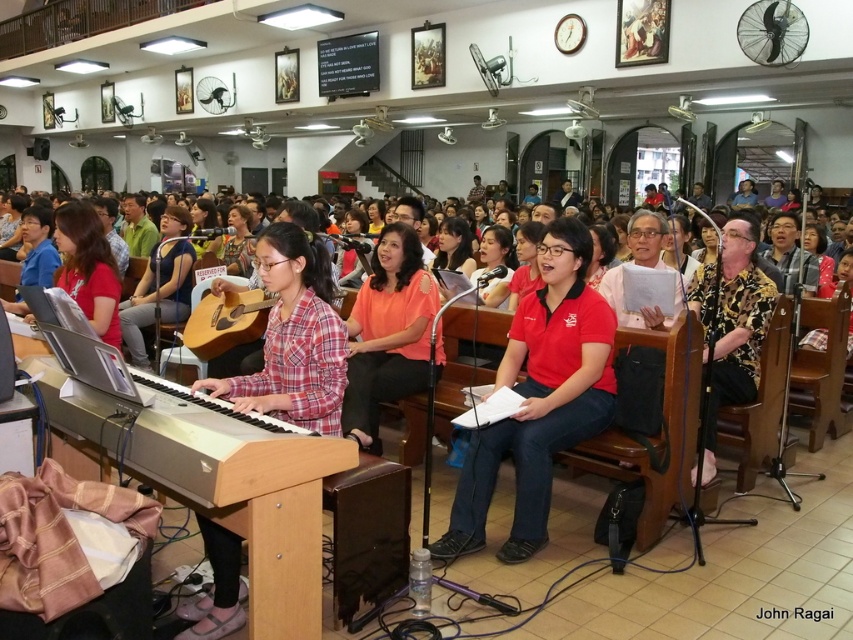
Question: Which point is farther to the camera?

Choices:
 (A) wooden piano at lower left
 (B) plaid fabric shirt at center
 (C) plaid fabric guitar at center
 (D) matte pink shirt at center

Answer: (C)

Question: Can you confirm if wooden piano at lower left is smaller than plaid fabric guitar at center?

Choices:
 (A) yes
 (B) no

Answer: (A)

Question: Is wooden piano at lower left behind orange matte shirt at center?

Choices:
 (A) no
 (B) yes

Answer: (A)

Question: Among these points, which one is farthest from the camera?

Choices:
 (A) (238, 592)
 (B) (440, 364)
 (C) (171, 452)
 (D) (521, 340)

Answer: (B)

Question: Which point is farther from the camera taking this photo?

Choices:
 (A) pyautogui.click(x=294, y=234)
 (B) pyautogui.click(x=154, y=275)
 (C) pyautogui.click(x=242, y=244)

Answer: (C)

Question: Can you confirm if plaid fabric guitar at center is positioned above matte pink shirt at center?

Choices:
 (A) no
 (B) yes

Answer: (A)